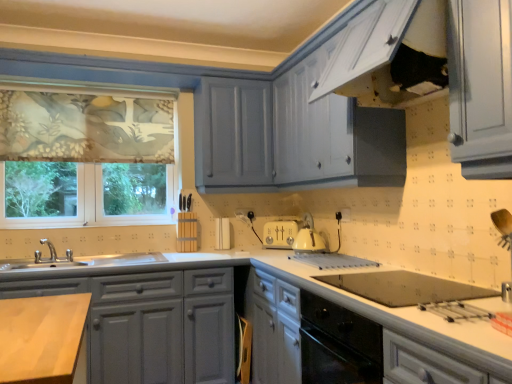
Question: Looking at their shapes, would you say matte gray cabinets at lower left, placed as the first cabinetry when sorted from left to right, is wider or thinner than white glossy oven at lower center, which is the second cabinetry in left-to-right order?

Choices:
 (A) wide
 (B) thin

Answer: (A)

Question: Relative to white glossy oven at lower center, which ranks as the 1th cabinetry in right-to-left order, is matte gray cabinets at lower left, placed as the first cabinetry when sorted from left to right, in front or behind?

Choices:
 (A) front
 (B) behind

Answer: (B)

Question: Which object is the closest to the floral fabric window at left?

Choices:
 (A) white glossy oven at lower center, which ranks as the 1th cabinetry in right-to-left order
 (B) matte gray cabinets at lower left, which ranks as the 2th cabinetry in right-to-left order

Answer: (B)

Question: Which object is the closest to the white glossy oven at lower center, which is the second cabinetry in left-to-right order?

Choices:
 (A) matte gray cabinets at lower left, which ranks as the 2th cabinetry in right-to-left order
 (B) floral fabric window at left

Answer: (A)